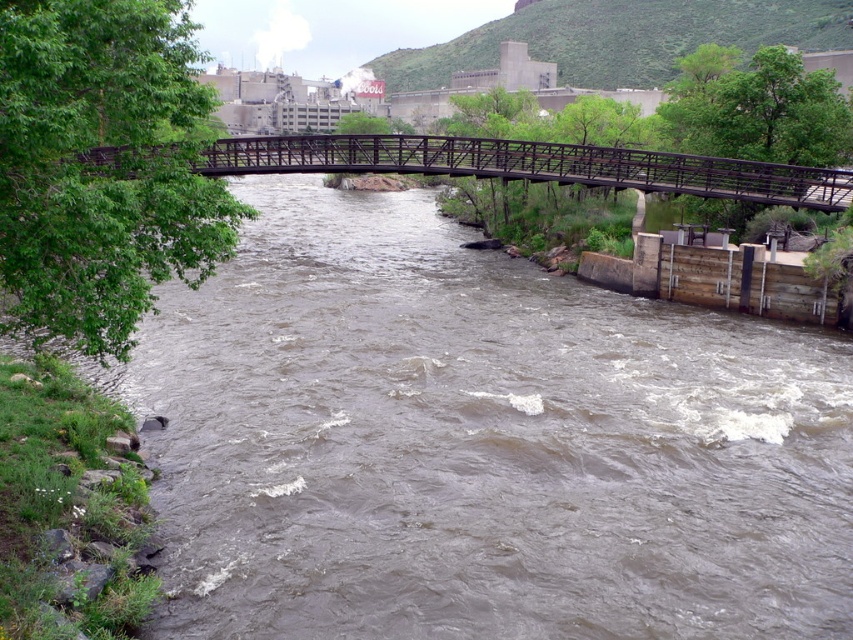
Question: Among these objects, which one is farthest from the camera?

Choices:
 (A) brown muddy water at center
 (B) metallic bridge at center

Answer: (A)

Question: Can you confirm if brown muddy water at center is positioned to the left of metallic bridge at center?

Choices:
 (A) no
 (B) yes

Answer: (B)

Question: Does brown muddy water at center appear under metallic bridge at center?

Choices:
 (A) yes
 (B) no

Answer: (A)

Question: Which point is farther to the camera?

Choices:
 (A) brown muddy water at center
 (B) metallic bridge at center

Answer: (A)

Question: Can you confirm if brown muddy water at center is smaller than metallic bridge at center?

Choices:
 (A) yes
 (B) no

Answer: (B)